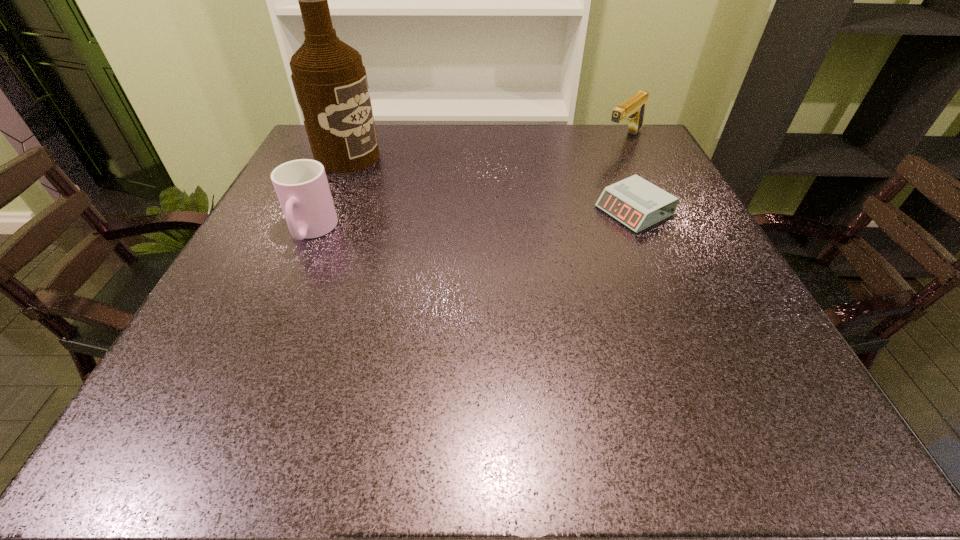
In the image, there is a desktop. Where is `free space at the far edge`? The image size is (960, 540). free space at the far edge is located at coordinates (442, 141).

Image resolution: width=960 pixels, height=540 pixels. In the image, there is a desktop. In order to click on vacant space at the near edge in this screenshot , I will do `click(487, 343)`.

Image resolution: width=960 pixels, height=540 pixels. Find the location of `vacant space at the right edge`. vacant space at the right edge is located at coordinates (651, 241).

The image size is (960, 540). Find the location of `vacant region at the near left corner`. vacant region at the near left corner is located at coordinates (270, 345).

Locate an element on the screen. This screenshot has height=540, width=960. free space at the far right corner is located at coordinates (656, 166).

Locate an element on the screen. The height and width of the screenshot is (540, 960). blank region between the pistol and the alarm clock is located at coordinates (629, 176).

The height and width of the screenshot is (540, 960). What are the coordinates of `unoccupied position between the tallest object and the pistol` in the screenshot? It's located at (486, 148).

Identify the location of vacant region between the shortest object and the tallest object. (491, 184).

This screenshot has height=540, width=960. What are the coordinates of `vacant region between the alarm clock and the pistol` in the screenshot? It's located at (629, 176).

This screenshot has height=540, width=960. What are the coordinates of `empty space between the pistol and the alarm clock` in the screenshot? It's located at (629, 176).